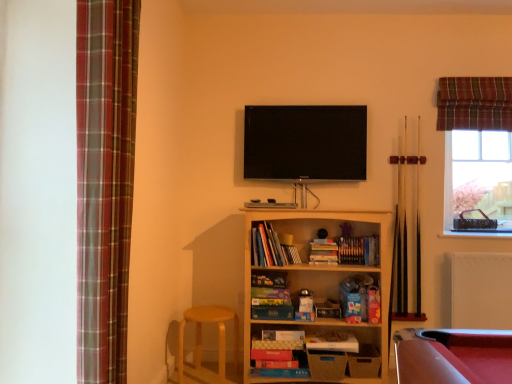
Where is `empty space that is ontop of white matte radiator at lower right (from a real-world perspective)`? empty space that is ontop of white matte radiator at lower right (from a real-world perspective) is located at coordinates (480, 244).